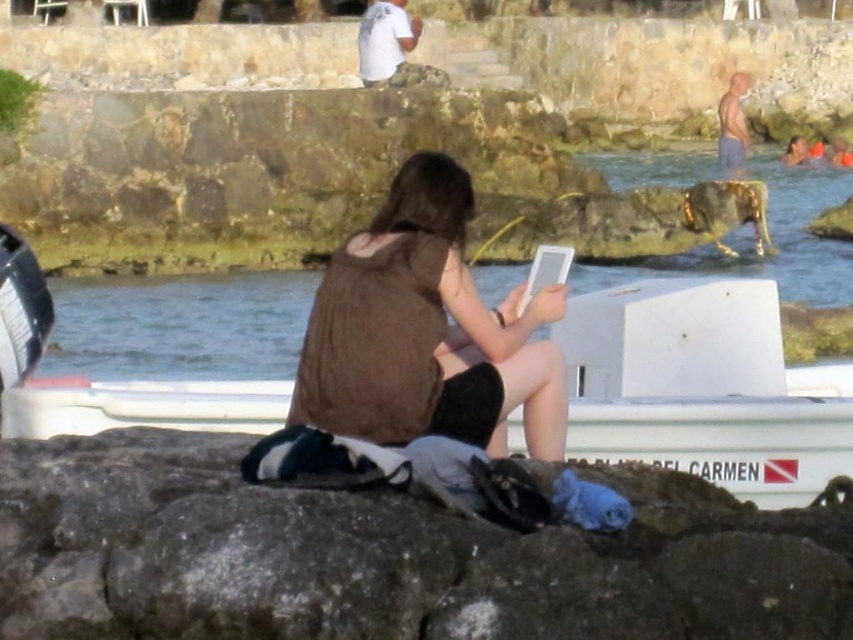
You are a photographer trying to capture a shot of the skinny bald man at upper right without the white matte boat at center blocking the view. Is this possible based on their positions?

The white matte boat at center is in front of the skinny bald man at upper right, so the boat would block the view of the man. You would need to move to a different angle or position to avoid the boat.

You are standing at the point labeled point (723, 106) and want to move towards the boat named CARMEN. Is the point labeled point (758, 492) in your path?

Yes, the point labeled point (758, 492) is in your path because it is in front of point (723, 106) according to the spatial arrangement.